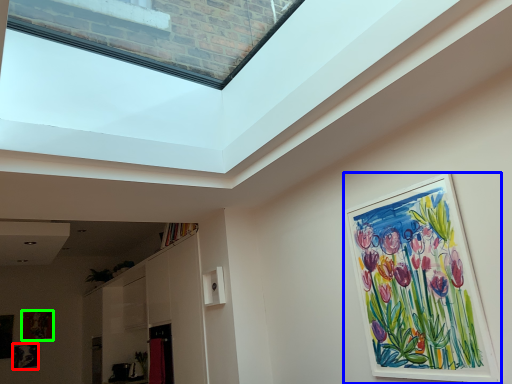
Question: Which object is positioned farthest from picture frame (highlighted by a red box)? Select from picture frame (highlighted by a blue box) and picture frame (highlighted by a green box).

Choices:
 (A) picture frame
 (B) picture frame

Answer: (A)